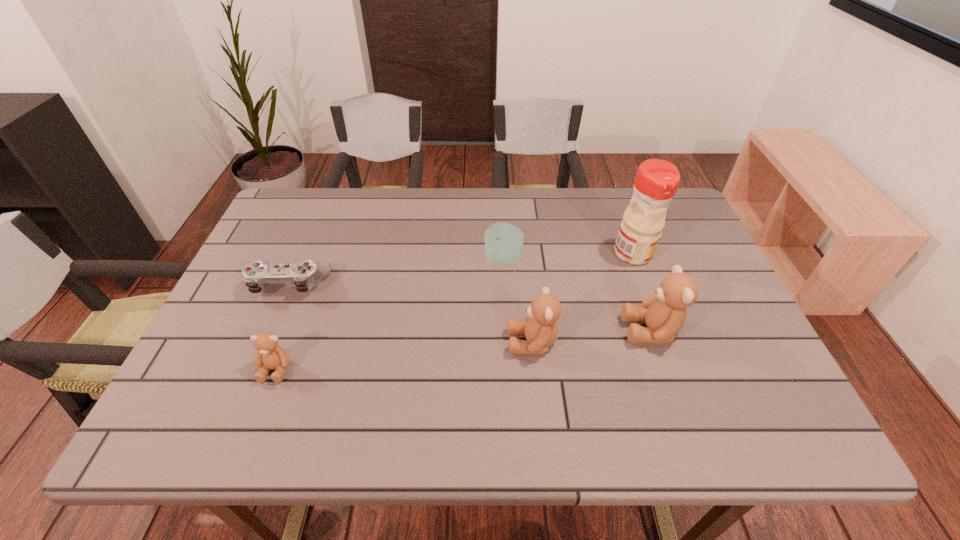
Identify which teddy bear is the second nearest to the second tallest teddy bear. Please provide its 2D coordinates. Your answer should be formatted as a tuple, i.e. [(x, y)], where the tuple contains the x and y coordinates of a point satisfying the conditions above.

[(270, 355)]

The width and height of the screenshot is (960, 540). Identify the location of teddy bear that is the second closest to the shortest teddy bear. (664, 312).

Identify the location of vacant area that satisfies the following two spatial constraints: 1. on the front-facing side of the rightmost teddy bear; 2. on the front-facing side of the leftmost teddy bear. (664, 369).

The width and height of the screenshot is (960, 540). Find the location of `free point that satisfies the following two spatial constraints: 1. on the front-facing side of the rightmost teddy bear; 2. on the front-facing side of the shortest teddy bear`. free point that satisfies the following two spatial constraints: 1. on the front-facing side of the rightmost teddy bear; 2. on the front-facing side of the shortest teddy bear is located at coordinates (664, 369).

You are a GUI agent. You are given a task and a screenshot of the screen. Output one action in this format:
    pyautogui.click(x=<x>, y=<y>)
    Task: Click on the vacant space that satisfies the following two spatial constraints: 1. on the front-facing side of the second shortest teddy bear; 2. on the front-facing side of the leftmost teddy bear
    The width and height of the screenshot is (960, 540).
    Given the screenshot: What is the action you would take?
    pyautogui.click(x=535, y=369)